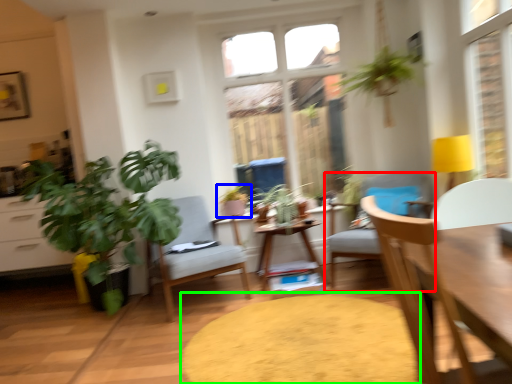
Question: Considering the real-world distances, which object is closest to chair (highlighted by a red box)? houseplant (highlighted by a blue box) or round table (highlighted by a green box).

Choices:
 (A) houseplant
 (B) round table

Answer: (B)